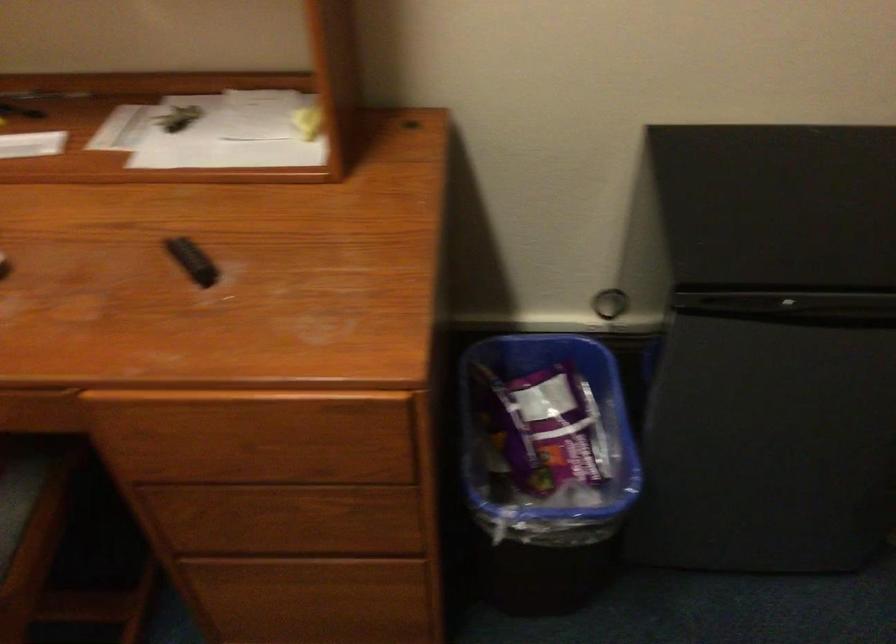
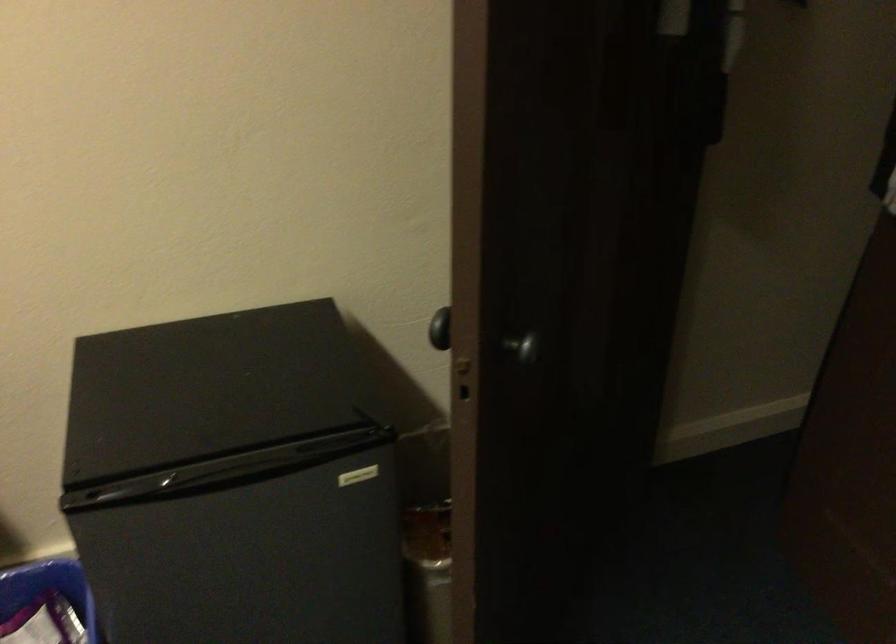
Question: What movement of the cameraman would produce the second image?

Choices:
 (A) Left
 (B) Right
 (C) Forward
 (D) Backward

Answer: (B)